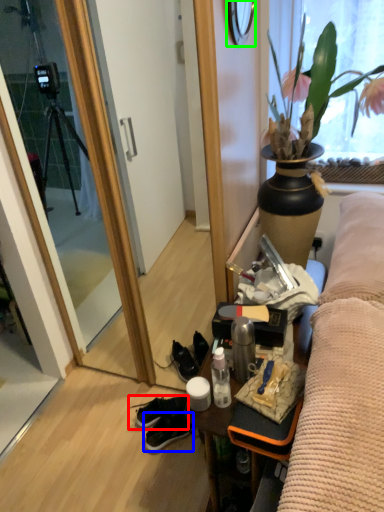
Question: Considering the real-world distances, which object is farthest from footwear (highlighted by a red box)? sneakers (highlighted by a blue box) or mirror (highlighted by a green box)?

Choices:
 (A) sneakers
 (B) mirror

Answer: (B)